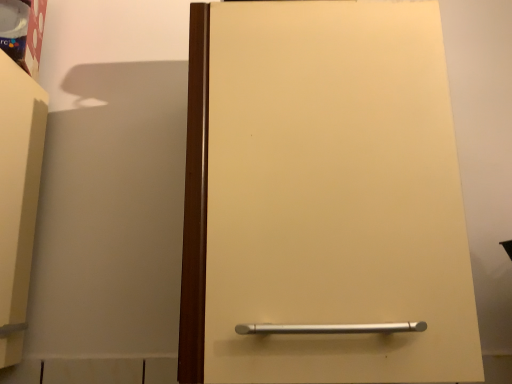
What is the approximate height of matte cream door at center?

matte cream door at center is 22.71 inches in height.

At what (x,y) coordinates should I click in order to perform the action: click on matte cream door at center. Please return your answer as a coordinate pair (x, y). Looking at the image, I should click on (323, 197).

Describe the element at coordinates (323, 197) in the screenshot. I see `matte cream door at center` at that location.

I want to click on matte cream door at center, so click(323, 197).